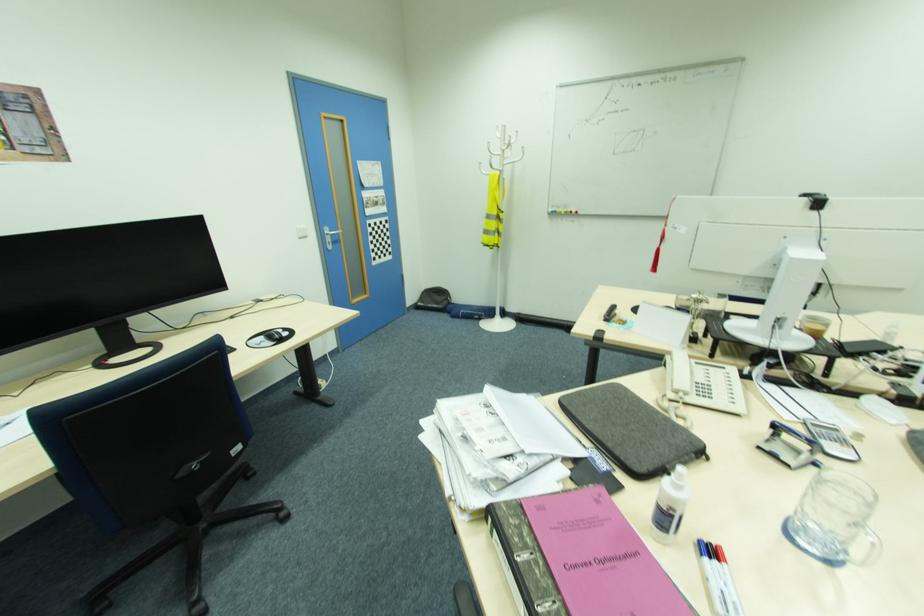
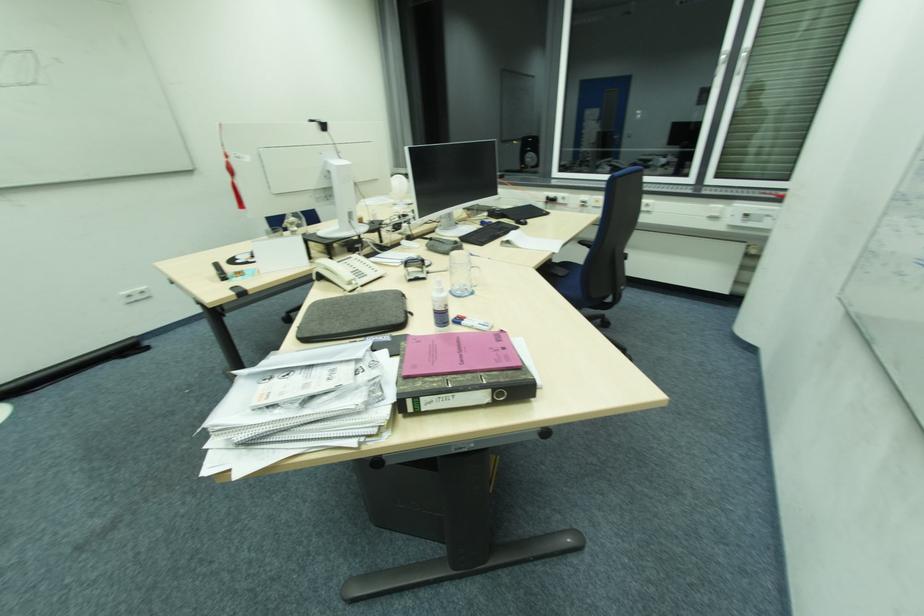
Find the pixel in the second image that matches (x=710, y=580) in the first image.

(477, 326)